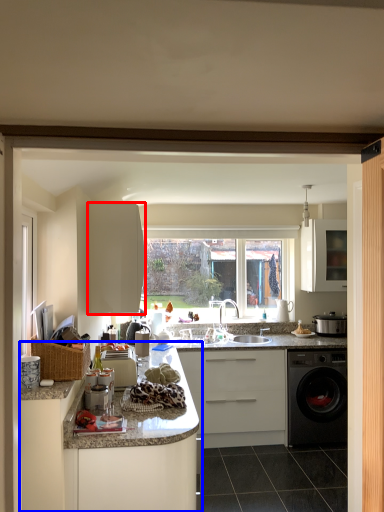
Question: Among these objects, which one is nearest to the camera, cabinetry (highlighted by a red box) or cabinetry (highlighted by a blue box)?

Choices:
 (A) cabinetry
 (B) cabinetry

Answer: (B)